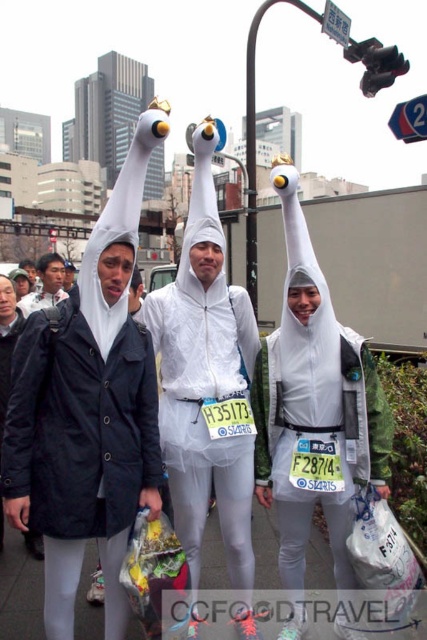
Question: Does white matte swan at upper center come behind matte black jacket at left?

Choices:
 (A) yes
 (B) no

Answer: (B)

Question: Which object is the closest to the white matte costume at center?

Choices:
 (A) white fabric pants at center
 (B) matte black jacket at left

Answer: (A)

Question: Is white matte swan at center to the left of matte black jacket at left from the viewer's perspective?

Choices:
 (A) no
 (B) yes

Answer: (A)

Question: Which object is the closest to the white matte swan at center?

Choices:
 (A) white fabric pants at center
 (B) white matte swan at upper center
 (C) matte black jacket at left

Answer: (B)

Question: Is white fabric pants at center wider than matte black jacket at left?

Choices:
 (A) yes
 (B) no

Answer: (B)

Question: Among these points, which one is farthest from the camera?

Choices:
 (A) [x=113, y=316]
 (B) [x=173, y=429]

Answer: (B)